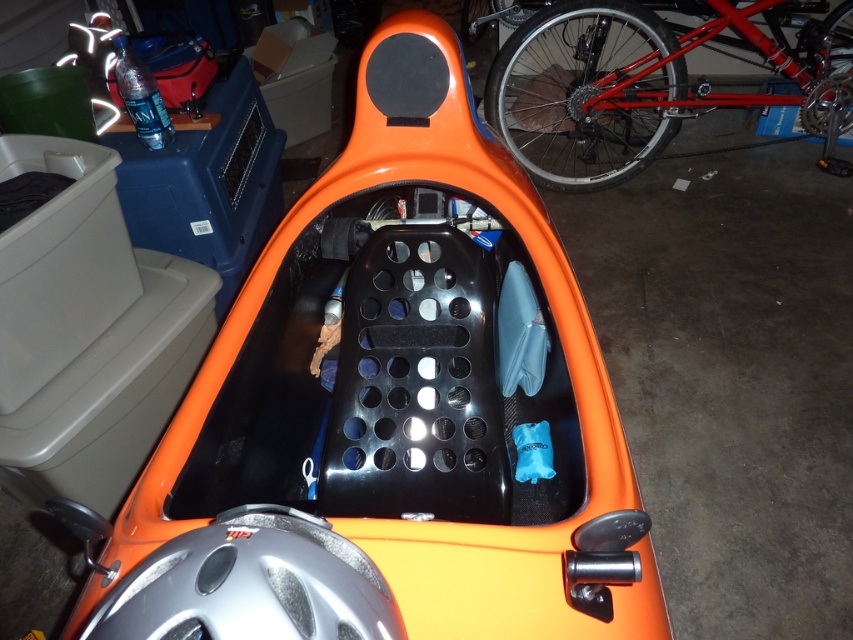
Between point (521, 42) and point (842, 125), which one is positioned behind?

The point (842, 125) is behind.

Does shiny red metal bicycle at upper right have a greater width compared to shiny metallic tire at upper right?

Indeed, shiny red metal bicycle at upper right has a greater width compared to shiny metallic tire at upper right.

You are a GUI agent. You are given a task and a screenshot of the screen. Output one action in this format:
    pyautogui.click(x=<x>, y=<y>)
    Task: Click on the shiny red metal bicycle at upper right
    The height and width of the screenshot is (640, 853).
    Given the screenshot: What is the action you would take?
    pyautogui.click(x=646, y=83)

Where is `shiny red metal bicycle at upper right`? shiny red metal bicycle at upper right is located at coordinates (646, 83).

Where is `orange glossy car at center`? The width and height of the screenshot is (853, 640). orange glossy car at center is located at coordinates (387, 413).

Between orange glossy car at center and shiny red metal bicycle at upper right, which one is positioned lower?

Positioned lower is orange glossy car at center.

Does point (426, 416) come in front of point (547, 33)?

Yes, it is.

Identify the location of orange glossy car at center. Image resolution: width=853 pixels, height=640 pixels. (387, 413).

Does orange glossy car at center appear on the right side of shiny metallic tire at upper right?

In fact, orange glossy car at center is to the left of shiny metallic tire at upper right.

What do you see at coordinates (387, 413) in the screenshot?
I see `orange glossy car at center` at bounding box center [387, 413].

Who is more distant from viewer, (224, 392) or (825, 72)?

Point (825, 72)

You are a GUI agent. You are given a task and a screenshot of the screen. Output one action in this format:
    pyautogui.click(x=<x>, y=<y>)
    Task: Click on the orange glossy car at center
    The width and height of the screenshot is (853, 640).
    Given the screenshot: What is the action you would take?
    pyautogui.click(x=387, y=413)